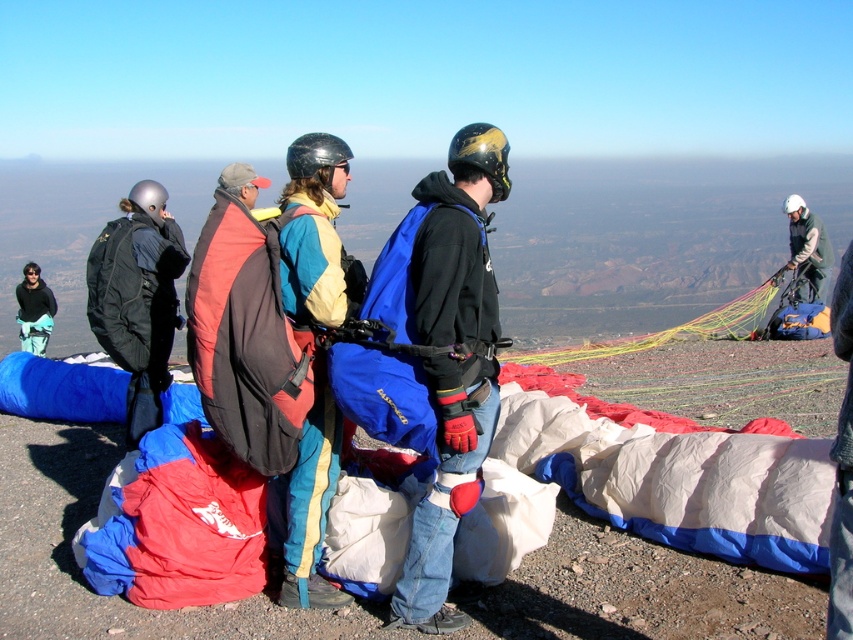
Which is more to the right, matte black backpack at left or brushed metal helmet at upper left?

matte black backpack at left is more to the right.

Is matte black backpack at left below brushed metal helmet at upper left?

Correct, matte black backpack at left is located below brushed metal helmet at upper left.

What do you see at coordinates (137, 298) in the screenshot?
I see `matte black backpack at left` at bounding box center [137, 298].

Find the location of a particular element. matte black backpack at left is located at coordinates (137, 298).

Which is below, blue fabric parachute at center or green fabric parachute at upper right?

blue fabric parachute at center is lower down.

Can you confirm if blue fabric parachute at center is positioned below green fabric parachute at upper right?

Indeed, blue fabric parachute at center is positioned under green fabric parachute at upper right.

In order to click on blue fabric parachute at center in this screenshot , I will do `click(453, 362)`.

Who is more distant from viewer, (183,269) or (787,216)?

Point (787,216)

Between matte black backpack at left and green fabric parachute at upper right, which one has more height?

With more height is matte black backpack at left.

You are a GUI agent. You are given a task and a screenshot of the screen. Output one action in this format:
    pyautogui.click(x=<x>, y=<y>)
    Task: Click on the matte black backpack at left
    Image resolution: width=853 pixels, height=640 pixels.
    Given the screenshot: What is the action you would take?
    pyautogui.click(x=137, y=298)